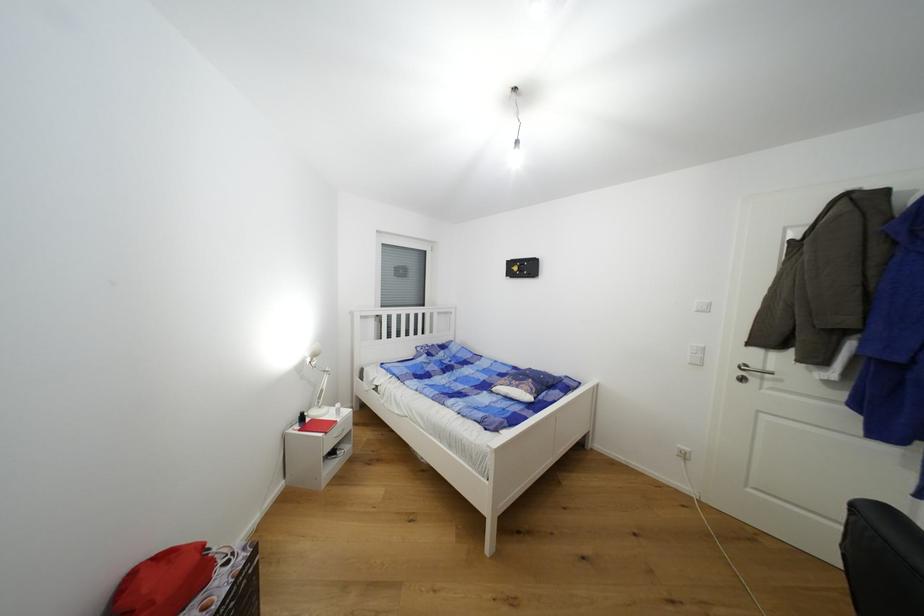
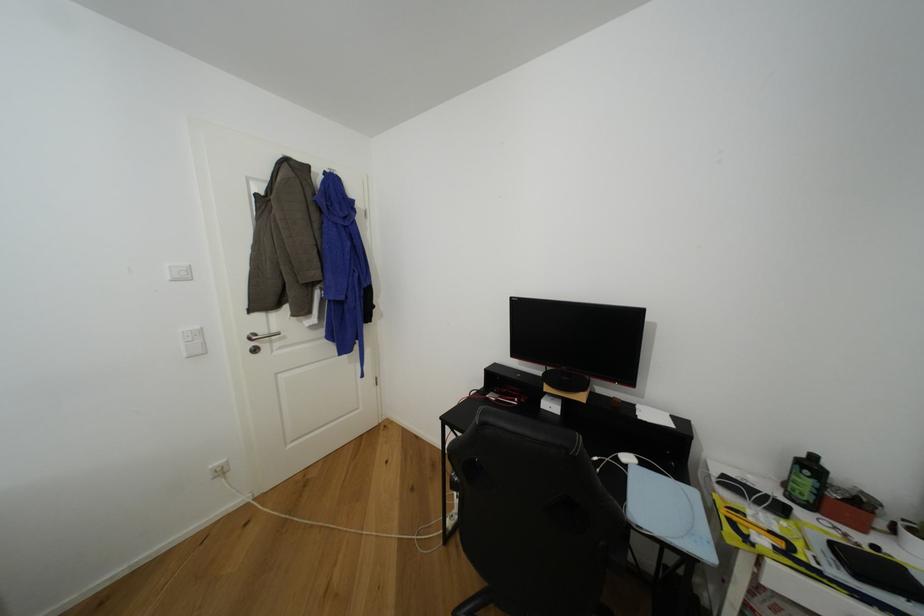
Question: The first image is from the beginning of the video and the second image is from the end. How did the camera likely rotate when shooting the video?

Choices:
 (A) Left
 (B) Right
 (C) Up
 (D) Down

Answer: (B)